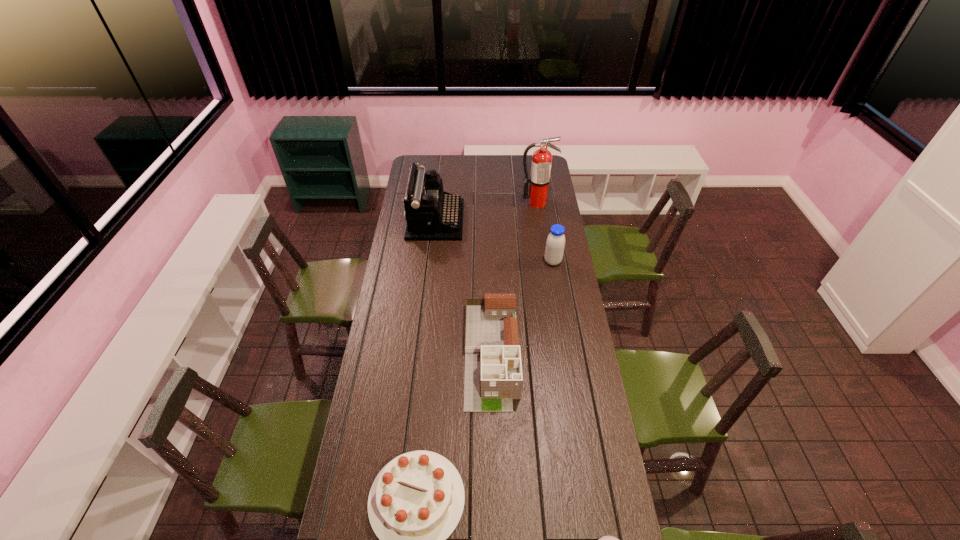
Where is `unoccupied position between the fire extinguisher and the fifth shortest object`? The height and width of the screenshot is (540, 960). unoccupied position between the fire extinguisher and the fifth shortest object is located at coordinates (486, 211).

Find the location of a particular element. vacant space in between the third farthest object and the fourth tallest object is located at coordinates (522, 307).

This screenshot has height=540, width=960. Identify the location of empty location between the second tallest object and the dollhouse. (464, 287).

In order to click on object that is the third closest to the fire extinguisher in this screenshot , I will do coord(493,371).

The width and height of the screenshot is (960, 540). In order to click on object that ranks as the fourth closest to the birthday cake in this screenshot , I will do `click(432, 214)`.

Where is `vacant position in the image that satisfies the following two spatial constraints: 1. on the typing side of the second tallest object; 2. on the back side of the fourth shortest object`? This screenshot has height=540, width=960. vacant position in the image that satisfies the following two spatial constraints: 1. on the typing side of the second tallest object; 2. on the back side of the fourth shortest object is located at coordinates (431, 261).

Where is `free spot that satisfies the following two spatial constraints: 1. on the nozzle side of the fire extinguisher; 2. on the typing side of the typewriter`? The image size is (960, 540). free spot that satisfies the following two spatial constraints: 1. on the nozzle side of the fire extinguisher; 2. on the typing side of the typewriter is located at coordinates (540, 220).